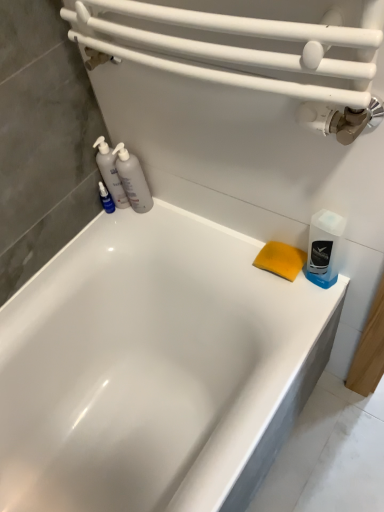
Where is `vacant space to the left of blue translucent bottle at right, which is counted as the third cleaning product, starting from the left`? The image size is (384, 512). vacant space to the left of blue translucent bottle at right, which is counted as the third cleaning product, starting from the left is located at coordinates (266, 292).